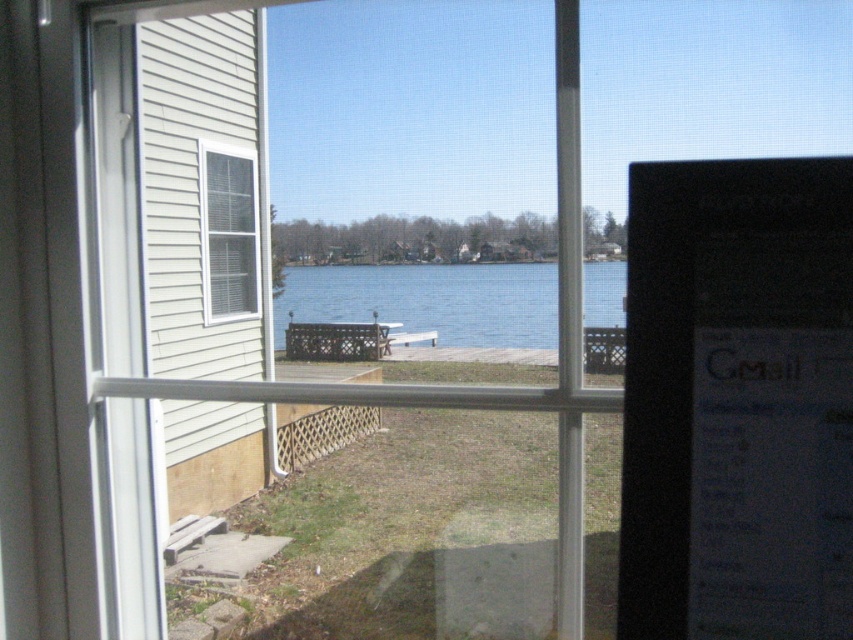
Question: Is blue water at center smaller than white plastic window at left?

Choices:
 (A) yes
 (B) no

Answer: (B)

Question: Which point is closer to the camera?

Choices:
 (A) (253, 189)
 (B) (372, 308)
 (C) (766, 548)

Answer: (C)

Question: Based on their relative distances, which object is nearer to the black glossy monitor at right?

Choices:
 (A) white plastic window at left
 (B) blue water at center

Answer: (B)

Question: From the image, what is the correct spatial relationship of blue water at center in relation to white plastic window at left?

Choices:
 (A) right
 (B) left

Answer: (A)

Question: Does blue water at center appear under white plastic window at left?

Choices:
 (A) yes
 (B) no

Answer: (A)

Question: Which point appears closest to the camera in this image?

Choices:
 (A) (254, 196)
 (B) (759, 208)

Answer: (B)